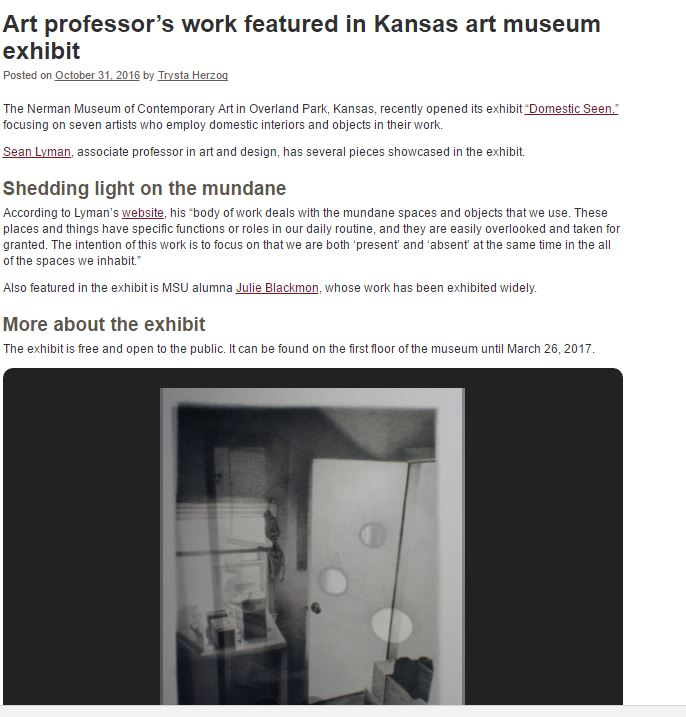
This screenshot has width=686, height=717. Find the location of `door handle`. door handle is located at coordinates (316, 609).